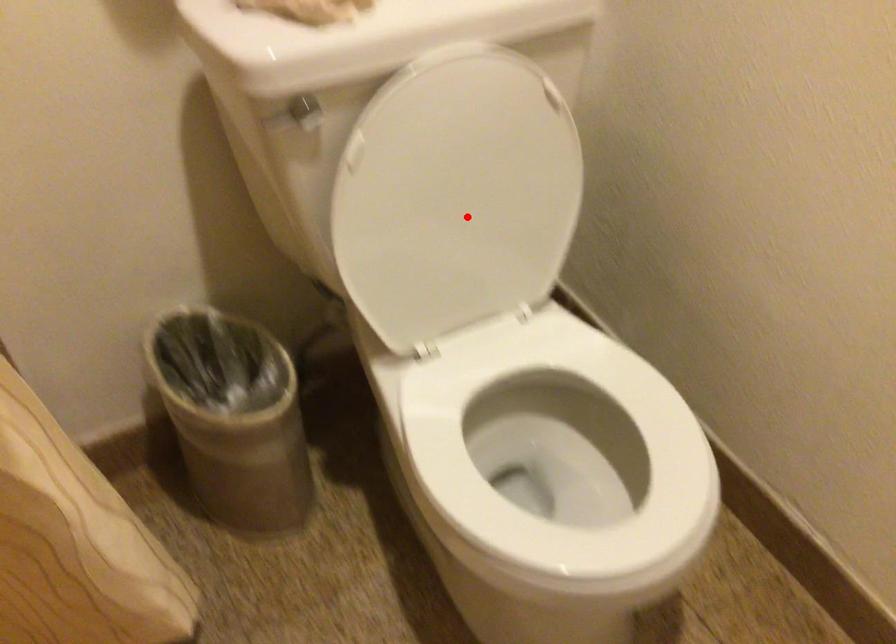
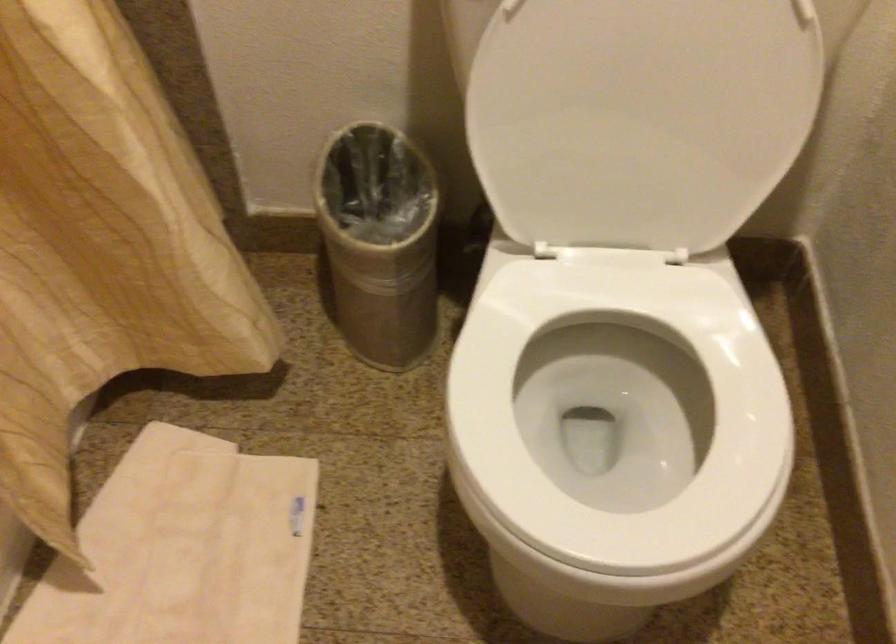
Locate, in the second image, the point that corresponds to the highlighted location in the first image.

(640, 118)